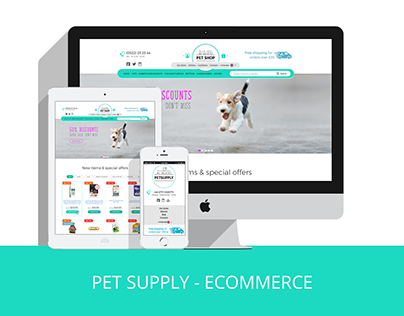
Locate an element on the screen. The height and width of the screenshot is (316, 404). phone is located at coordinates (181, 154).